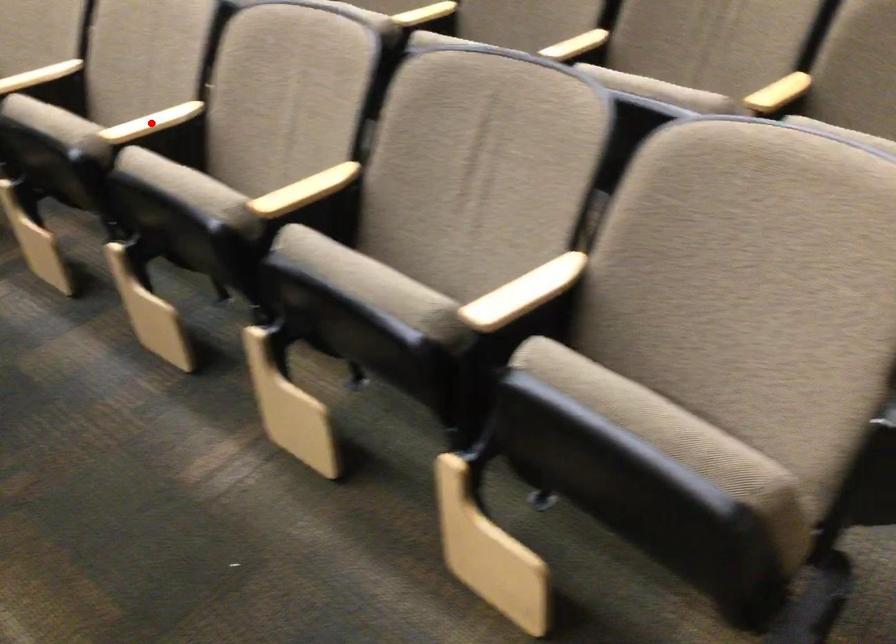
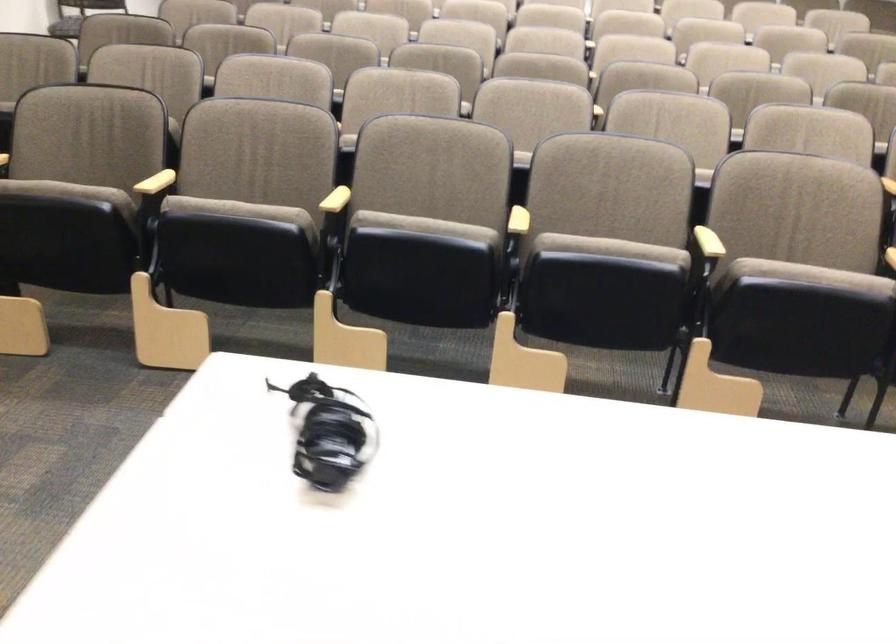
Question: I am providing you with two images of the same scene from different viewpoints. A red point is marked on the first image. Can you still see the location of the red point in image 2?

Choices:
 (A) Yes
 (B) No

Answer: (B)